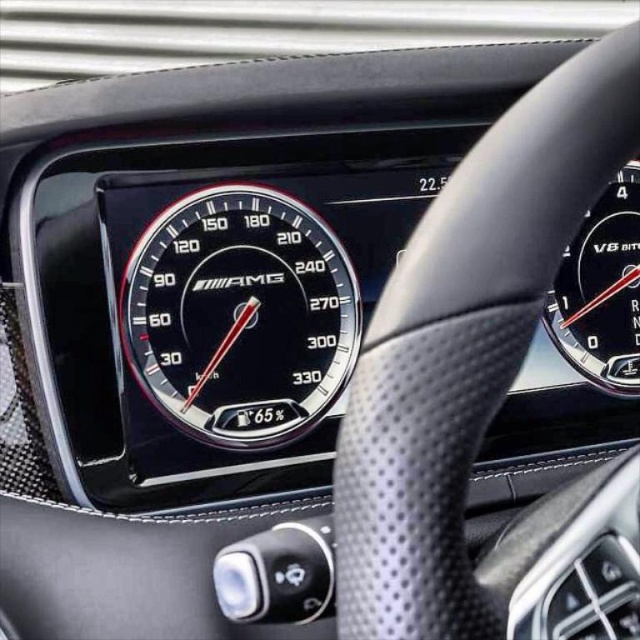
Does black leather steering wheel at center have a greater height compared to black glossy speedometer at upper right?

Correct, black leather steering wheel at center is much taller as black glossy speedometer at upper right.

Is point (458, 611) farther from camera compared to point (600, 378)?

That is False.

Locate an element on the screen. The width and height of the screenshot is (640, 640). black leather steering wheel at center is located at coordinates (468, 356).

Between point (301, 321) and point (572, 328), which one is positioned behind?

The point (572, 328) is more distant.

Is black glossy speedometer at center above black glossy speedometer at upper right?

No.

This screenshot has height=640, width=640. Identify the location of black glossy speedometer at center. (241, 316).

The width and height of the screenshot is (640, 640). I want to click on black glossy speedometer at center, so click(241, 316).

Who is more forward, (420, 557) or (314, 252)?

Point (420, 557) is in front.

How far apart are black leather steering wheel at center and black glossy speedometer at center?

A distance of 15.01 inches exists between black leather steering wheel at center and black glossy speedometer at center.

Where is `black leather steering wheel at center`? black leather steering wheel at center is located at coordinates (468, 356).